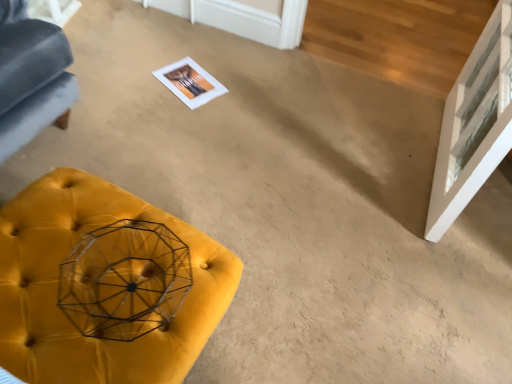
I want to click on free area below transparent glass door at upper right (from a real-world perspective), so click(x=412, y=157).